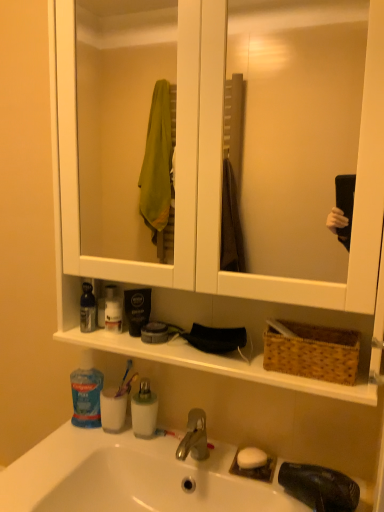
You are a GUI agent. You are given a task and a screenshot of the screen. Output one action in this format:
    pyautogui.click(x=<x>, y=<y>)
    Task: Click on the free space in front of blue translucent mouthwash at lower left, arranged as the 2th mouthwash when viewed from the right
    The width and height of the screenshot is (384, 512).
    Given the screenshot: What is the action you would take?
    pyautogui.click(x=92, y=454)